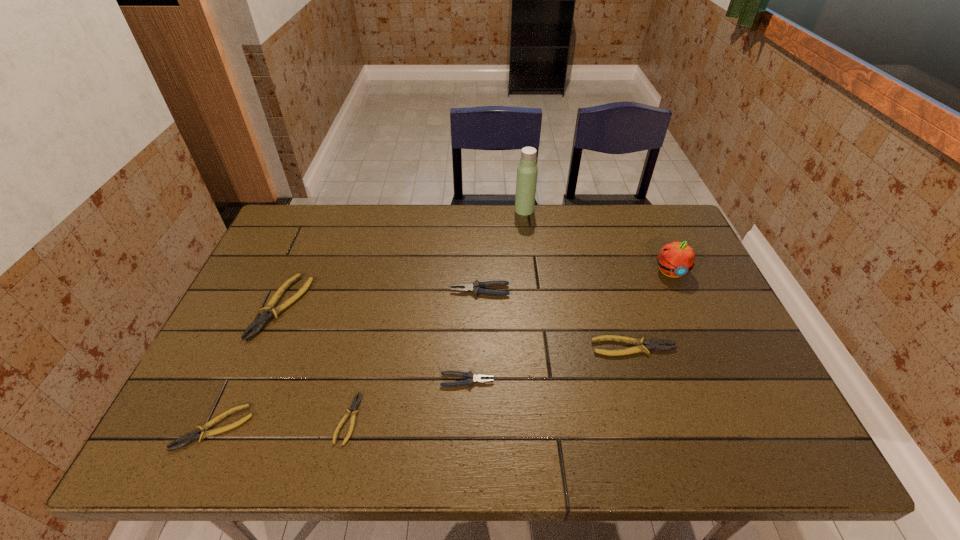
The height and width of the screenshot is (540, 960). I want to click on the fifth tallest pliers, so click(x=195, y=435).

This screenshot has width=960, height=540. I want to click on the second smallest yellow pliers, so click(x=195, y=435).

You are a GUI agent. You are given a task and a screenshot of the screen. Output one action in this format:
    pyautogui.click(x=<x>, y=<y>)
    Task: Click on the smallest yellow pliers
    Image resolution: width=960 pixels, height=540 pixels.
    Given the screenshot: What is the action you would take?
    pyautogui.click(x=355, y=403)

Find the location of a particular element. the shortest object is located at coordinates (355, 403).

Find the location of `vacant region located on the front of the tallest object`. vacant region located on the front of the tallest object is located at coordinates (529, 246).

The image size is (960, 540). I want to click on free space located on the left of the second tallest object, so click(634, 272).

Where is `vacant space situated 0.210m at the gripping part of the farther gray pliers`? The height and width of the screenshot is (540, 960). vacant space situated 0.210m at the gripping part of the farther gray pliers is located at coordinates (377, 291).

Where is `free location located at the gripping part of the farther gray pliers`? The height and width of the screenshot is (540, 960). free location located at the gripping part of the farther gray pliers is located at coordinates (395, 291).

Locate an element on the screen. The width and height of the screenshot is (960, 540). free space located at the gripping part of the farther gray pliers is located at coordinates (357, 291).

Where is `free location located 0.200m on the back of the biggest yellow pliers`? The height and width of the screenshot is (540, 960). free location located 0.200m on the back of the biggest yellow pliers is located at coordinates (313, 234).